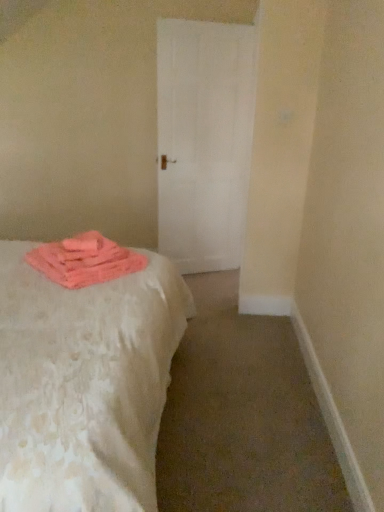
Question: Is white textured bed at left with pink fluffy towel at lower left?

Choices:
 (A) yes
 (B) no

Answer: (B)

Question: Considering the relative sizes of white textured bed at left and pink fluffy towel at lower left in the image provided, is white textured bed at left smaller than pink fluffy towel at lower left?

Choices:
 (A) no
 (B) yes

Answer: (A)

Question: Is white textured bed at left positioned with its back to pink fluffy towel at lower left?

Choices:
 (A) no
 (B) yes

Answer: (B)

Question: Does white textured bed at left have a larger size compared to pink fluffy towel at lower left?

Choices:
 (A) no
 (B) yes

Answer: (B)

Question: Is white textured bed at left at the right side of pink fluffy towel at lower left?

Choices:
 (A) no
 (B) yes

Answer: (A)

Question: Is white textured bed at left not near pink fluffy towel at lower left?

Choices:
 (A) no
 (B) yes

Answer: (A)

Question: Considering the relative sizes of pink fluffy towel at lower left and white matte door at center in the image provided, is pink fluffy towel at lower left bigger than white matte door at center?

Choices:
 (A) yes
 (B) no

Answer: (B)

Question: From the image's perspective, would you say pink fluffy towel at lower left is positioned over white matte door at center?

Choices:
 (A) yes
 (B) no

Answer: (B)

Question: Is the surface of pink fluffy towel at lower left in direct contact with white matte door at center?

Choices:
 (A) yes
 (B) no

Answer: (B)

Question: Is pink fluffy towel at lower left at the right side of white matte door at center?

Choices:
 (A) no
 (B) yes

Answer: (A)

Question: From a real-world perspective, is pink fluffy towel at lower left beneath white matte door at center?

Choices:
 (A) no
 (B) yes

Answer: (B)

Question: Is pink fluffy towel at lower left facing towards white matte door at center?

Choices:
 (A) yes
 (B) no

Answer: (B)

Question: Is white matte door at center facing towards pink fluffy towel at lower left?

Choices:
 (A) yes
 (B) no

Answer: (B)